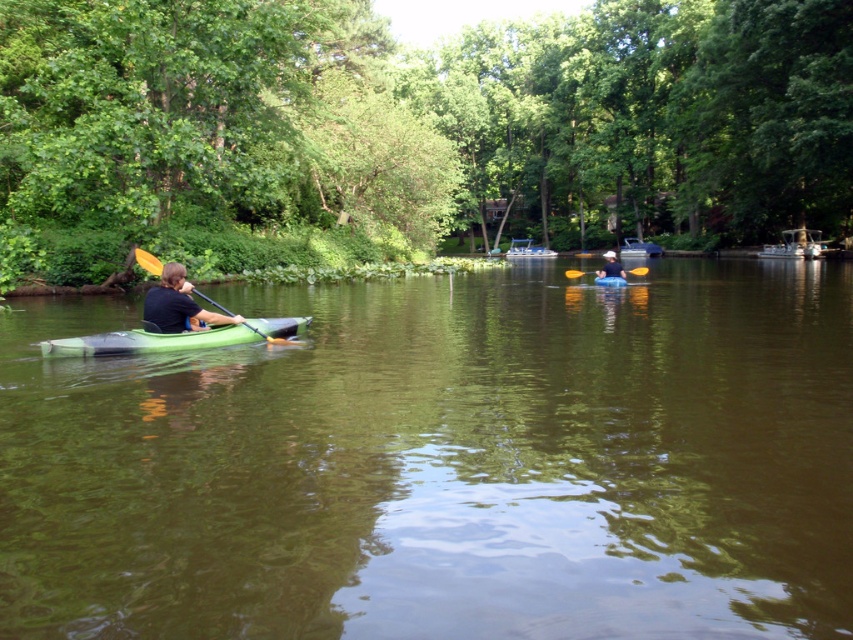
Is point (790, 381) positioned behind point (210, 344)?

No, it is not.

Does green rubber kayak at left appear on the right side of green matte kayak at left?

Yes, green rubber kayak at left is to the right of green matte kayak at left.

Who is more distant from viewer, (x=450, y=310) or (x=178, y=348)?

Positioned behind is point (x=450, y=310).

What are the coordinates of `green rubber kayak at left` in the screenshot? It's located at pyautogui.click(x=444, y=461).

Is green matte kayak at left positioned behind yellow plastic paddle at center?

No, green matte kayak at left is in front of yellow plastic paddle at center.

Between green matte kayak at left and yellow plastic paddle at center, which one is positioned higher?

Positioned higher is yellow plastic paddle at center.

Where is `green matte kayak at left`? This screenshot has height=640, width=853. green matte kayak at left is located at coordinates (148, 340).

Image resolution: width=853 pixels, height=640 pixels. I want to click on green matte kayak at left, so click(x=148, y=340).

Is white matte kayak at center to the left of blue rubber canoe at center from the viewer's perspective?

In fact, white matte kayak at center is to the right of blue rubber canoe at center.

Does point (614, 272) lie behind point (624, 282)?

No, it is in front of (624, 282).

What do you see at coordinates (610, 266) in the screenshot? The width and height of the screenshot is (853, 640). I see `white matte kayak at center` at bounding box center [610, 266].

Where is `white matte kayak at center`? white matte kayak at center is located at coordinates (610, 266).